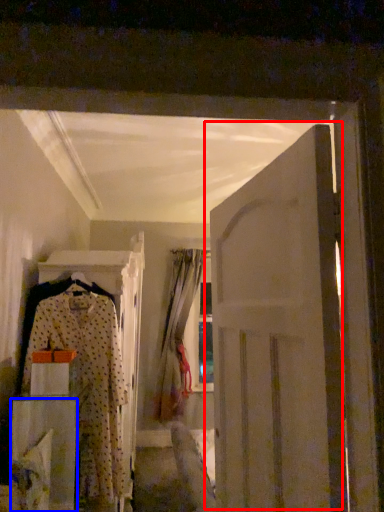
Question: Which object is closer to the camera taking this photo, door (highlighted by a red box) or furniture (highlighted by a blue box)?

Choices:
 (A) door
 (B) furniture

Answer: (A)